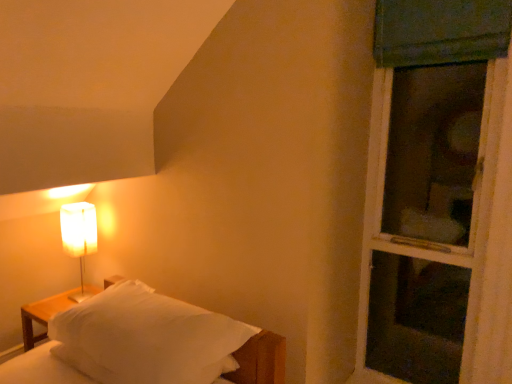
Question: From the image's perspective, relative to white soft bed at lower left, is green fabric screen door at right above or below?

Choices:
 (A) above
 (B) below

Answer: (A)

Question: Is point (454, 178) closer or farther from the camera than point (119, 299)?

Choices:
 (A) closer
 (B) farther

Answer: (B)

Question: Which object is positioned closest to the white soft bed at lower left?

Choices:
 (A) green fabric screen door at right
 (B) white paper lampshade at left

Answer: (B)

Question: Which object is the closest to the green fabric screen door at right?

Choices:
 (A) white soft bed at lower left
 (B) white paper lampshade at left

Answer: (A)